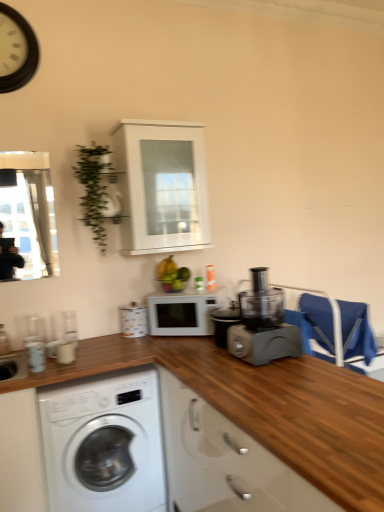
Image resolution: width=384 pixels, height=512 pixels. I want to click on free region on the left part of matte plastic food processor at center-right, so click(199, 364).